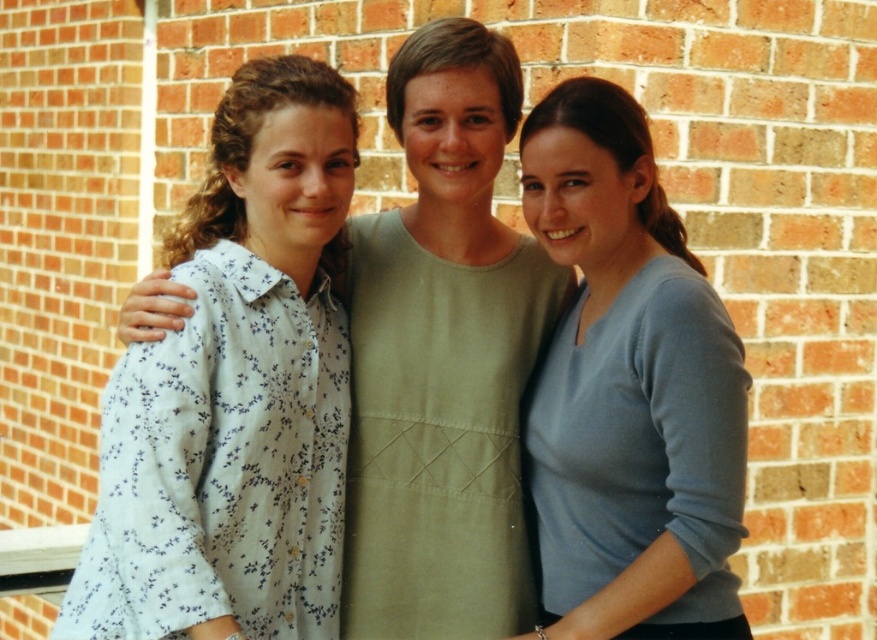
Does white floral shirt at left have a larger size compared to light green fabric dress at center?

Indeed, white floral shirt at left has a larger size compared to light green fabric dress at center.

Does white floral shirt at left have a greater width compared to light green fabric dress at center?

Indeed, white floral shirt at left has a greater width compared to light green fabric dress at center.

Describe the element at coordinates (234, 392) in the screenshot. I see `white floral shirt at left` at that location.

Find the location of `white floral shirt at left`. white floral shirt at left is located at coordinates (234, 392).

Is white floral shirt at left wider than light blue sweater at center?

Yes.

How far apart are white floral shirt at left and light blue sweater at center?

They are 3.49 feet apart.

You are a GUI agent. You are given a task and a screenshot of the screen. Output one action in this format:
    pyautogui.click(x=<x>, y=<y>)
    Task: Click on the white floral shirt at left
    The width and height of the screenshot is (877, 640).
    Given the screenshot: What is the action you would take?
    pyautogui.click(x=234, y=392)

Locate an element on the screen. This screenshot has height=640, width=877. white floral shirt at left is located at coordinates (234, 392).

Does point (362, 589) come closer to viewer compared to point (632, 257)?

No, (362, 589) is further to viewer.

Is point (374, 308) farther from camera compared to point (676, 388)?

Yes, it is behind point (676, 388).

The width and height of the screenshot is (877, 640). I want to click on light green fabric dress at center, so click(446, 360).